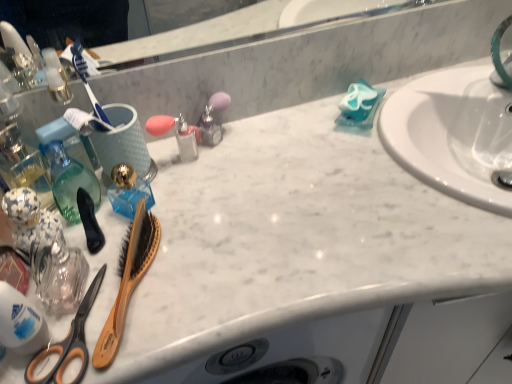
Locate an element on the screen. Image resolution: width=512 pixels, height=384 pixels. vacant space that is in between blue matte soap at upper right, acting as the 2th cleaning product starting from the front, and orange-handled scissors at lower left is located at coordinates (251, 199).